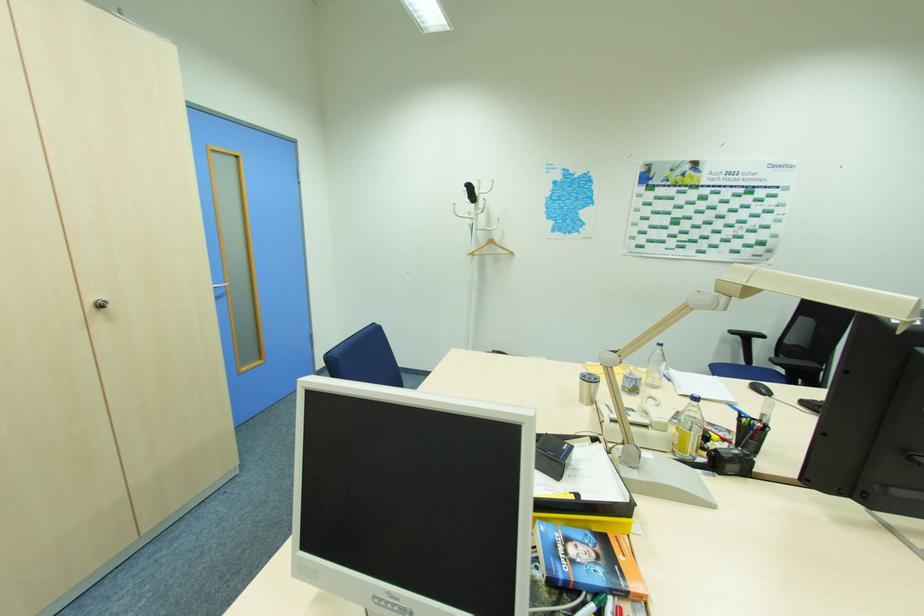
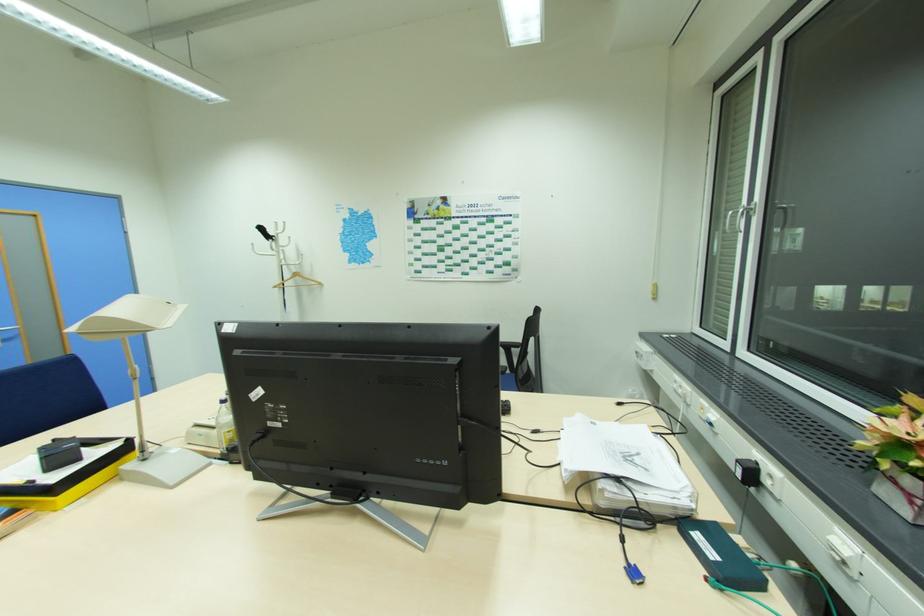
In the second image, find the point that corresponds to point 479,197 in the first image.

(276, 237)